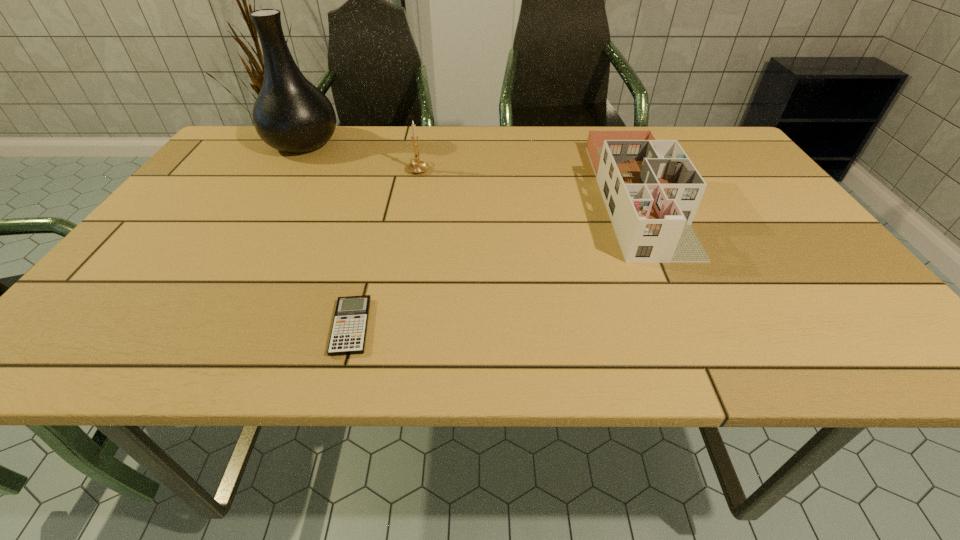
Where is `vacant space located 0.090m on the handle side of the third shortest object`? This screenshot has width=960, height=540. vacant space located 0.090m on the handle side of the third shortest object is located at coordinates (423, 146).

What are the coordinates of `free point located 0.080m on the handle side of the third shortest object` in the screenshot? It's located at (422, 147).

This screenshot has height=540, width=960. I want to click on vacant space situated at the front door of the third tallest object, so pyautogui.click(x=680, y=287).

Identify the location of free space located 0.240m on the back of the calculator. The image size is (960, 540). (379, 222).

Find the location of a particular element. The height and width of the screenshot is (540, 960). vase that is positioned at the far edge is located at coordinates (290, 114).

Locate an element on the screen. The width and height of the screenshot is (960, 540). candle holder that is at the far edge is located at coordinates (416, 166).

The image size is (960, 540). Find the location of `dollhouse present at the far edge`. dollhouse present at the far edge is located at coordinates click(x=651, y=189).

Where is `object that is positioned at the near edge`? This screenshot has width=960, height=540. object that is positioned at the near edge is located at coordinates (348, 335).

Locate an element on the screen. object located at the left edge is located at coordinates (290, 114).

Find the location of a particular element. The image size is (960, 540). object positioned at the far left corner is located at coordinates (290, 114).